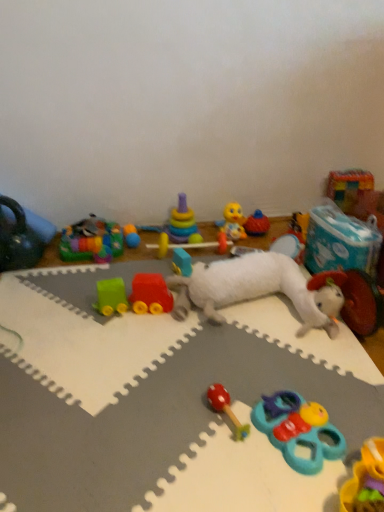
Identify the location of free space that is in between smooth red wooden rattle at center, the 9th toy in the right-to-left sequence, and white plush lamb at center, the 7th toy from the right. This screenshot has height=512, width=384. (251, 360).